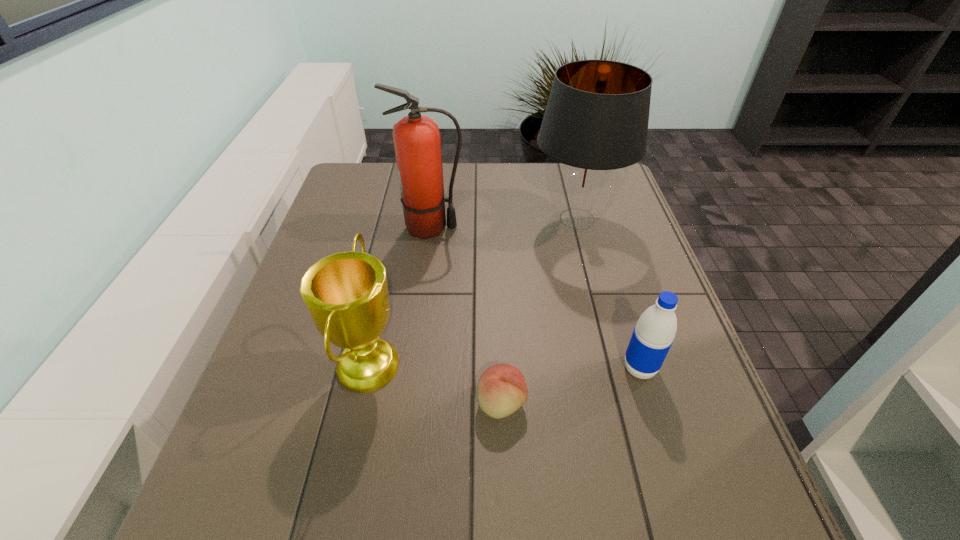
Where is `vacant area between the lampshade and the third shortest object`? vacant area between the lampshade and the third shortest object is located at coordinates (473, 291).

Identify the location of the fourth closest object relative to the award. (653, 335).

You are a GUI agent. You are given a task and a screenshot of the screen. Output one action in this format:
    pyautogui.click(x=<x>, y=<y>)
    Task: Click on the object that stands as the closest to the third object from right to left
    The width and height of the screenshot is (960, 540).
    Given the screenshot: What is the action you would take?
    coord(346,294)

You are a GUI agent. You are given a task and a screenshot of the screen. Output one action in this format:
    pyautogui.click(x=<x>, y=<y>)
    Task: Click on the free location that satisfies the following two spatial constraints: 1. on the nozzle of the fourth tallest object; 2. on the left side of the fire extinguisher
    
    Given the screenshot: What is the action you would take?
    pyautogui.click(x=412, y=368)

At what (x,y) coordinates should I click in order to perform the action: click on vacant space that satisfies the following two spatial constraints: 1. on the shiny surface of the third shortest object; 2. on the back side of the third object from left to right. Please return your answer as a coordinate pair (x, y). Looking at the image, I should click on (360, 403).

This screenshot has height=540, width=960. What are the coordinates of `free space that satisfies the following two spatial constraints: 1. on the nozzle of the third object from left to right; 2. on the left side of the fire extinguisher` in the screenshot? It's located at (408, 403).

You are a GUI agent. You are given a task and a screenshot of the screen. Output one action in this format:
    pyautogui.click(x=<x>, y=<y>)
    Task: Click on the free space that satisfies the following two spatial constraints: 1. on the back side of the water bottle; 2. on the nozzle of the fire extinguisher
    
    Given the screenshot: What is the action you would take?
    pyautogui.click(x=596, y=228)

The height and width of the screenshot is (540, 960). What are the coordinates of `free location that satisfies the following two spatial constraints: 1. on the nozzle of the fire extinguisher; 2. on the back side of the water bottle` in the screenshot? It's located at (412, 368).

Where is `vacant position in the image that satisfies the following two spatial constraints: 1. on the shiny surface of the award; 2. on the back side of the water bottle`? vacant position in the image that satisfies the following two spatial constraints: 1. on the shiny surface of the award; 2. on the back side of the water bottle is located at coordinates (368, 368).

This screenshot has height=540, width=960. Find the location of `vacant space that satisfies the following two spatial constraints: 1. on the shiny surface of the peach; 2. on the right side of the third shortest object`. vacant space that satisfies the following two spatial constraints: 1. on the shiny surface of the peach; 2. on the right side of the third shortest object is located at coordinates (360, 403).